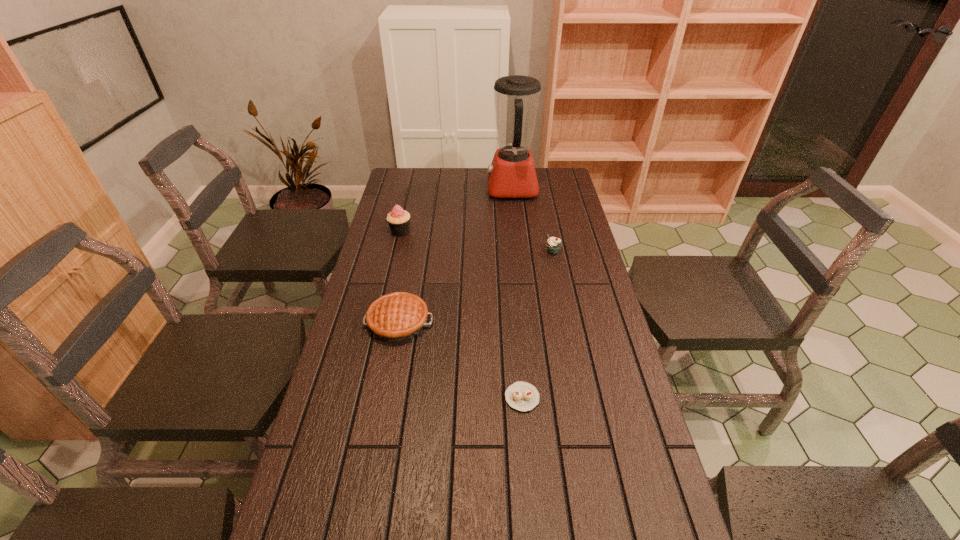
What are the coordinates of `blender` in the screenshot? It's located at (512, 174).

You are a GUI agent. You are given a task and a screenshot of the screen. Output one action in this format:
    pyautogui.click(x=<x>, y=<y>)
    Task: Click on the tallest object
    The height and width of the screenshot is (540, 960).
    Given the screenshot: What is the action you would take?
    pyautogui.click(x=512, y=174)

Locate an element on the screen. The width and height of the screenshot is (960, 540). the leftmost cupcake is located at coordinates (398, 219).

Where is `the tallest cupcake`? This screenshot has width=960, height=540. the tallest cupcake is located at coordinates (398, 219).

The width and height of the screenshot is (960, 540). What are the coordinates of `the second shortest cupcake` in the screenshot? It's located at (553, 244).

This screenshot has height=540, width=960. In order to click on the second farthest cupcake in this screenshot , I will do `click(553, 244)`.

Locate an element on the screen. The image size is (960, 540). pie is located at coordinates (400, 316).

This screenshot has width=960, height=540. I want to click on the nearest object, so click(522, 396).

Identify the location of the shortest cupcake. (522, 396).

The image size is (960, 540). In order to click on vacant area located on the front of the blender near the controls in this screenshot , I will do `click(433, 189)`.